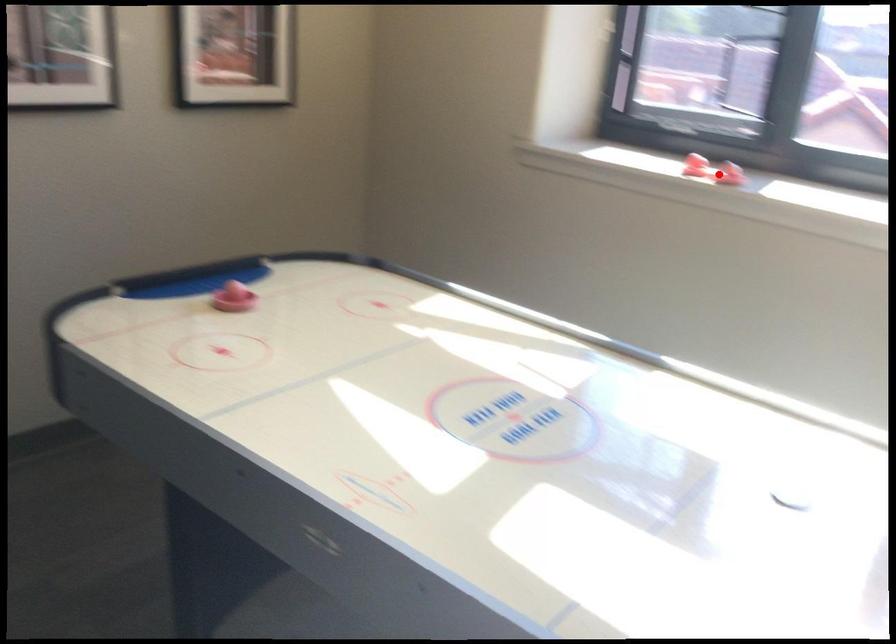
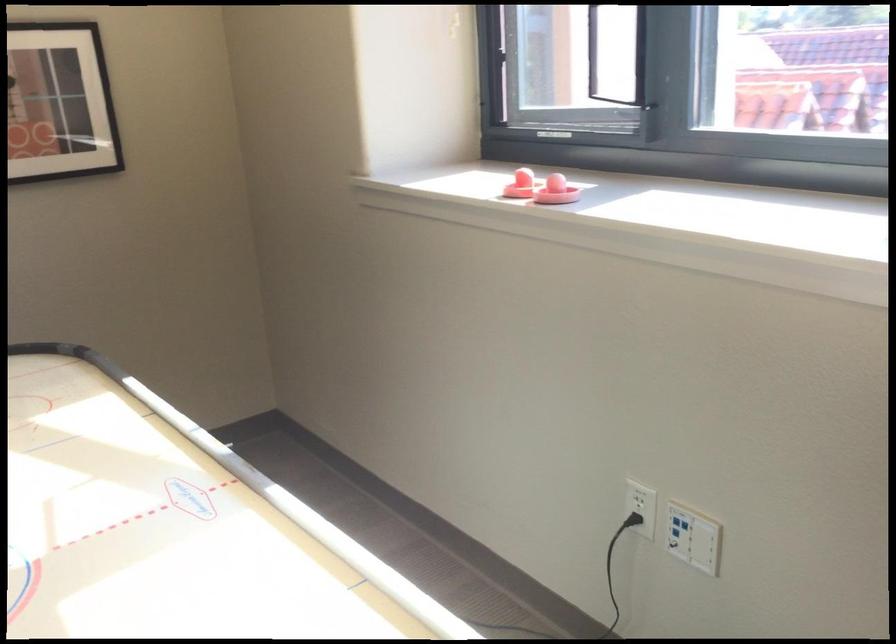
Question: I am providing you with two images of the same scene from different viewpoints. Given a red point in image1, look at the same physical point in image2. Is it:

Choices:
 (A) Closer to the viewpoint
 (B) Farther from the viewpoint

Answer: (A)